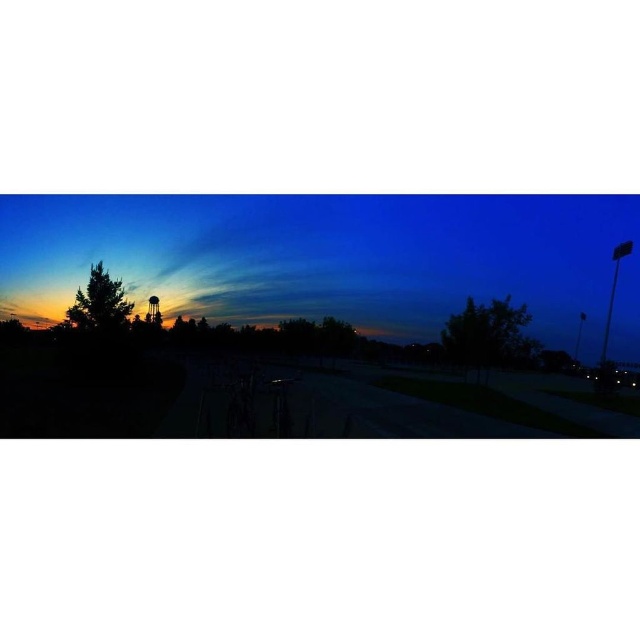
Question: Does silhouette trees at left lie behind green leafy tree at center?

Choices:
 (A) yes
 (B) no

Answer: (B)

Question: Does green leafy tree at center have a smaller size compared to green matte tree at left?

Choices:
 (A) no
 (B) yes

Answer: (A)

Question: From the image, what is the correct spatial relationship of green leafy tree at center in relation to green matte tree at left?

Choices:
 (A) right
 (B) left

Answer: (A)

Question: Which object is positioned farthest from the silhouette trees at left?

Choices:
 (A) green leafy tree at center
 (B) green matte tree at left

Answer: (A)

Question: Which is farther from the green matte tree at left?

Choices:
 (A) green leafy tree at center
 (B) silhouette trees at left

Answer: (B)

Question: Among these points, which one is farthest from the camera?

Choices:
 (A) (74, 301)
 (B) (156, 285)

Answer: (B)